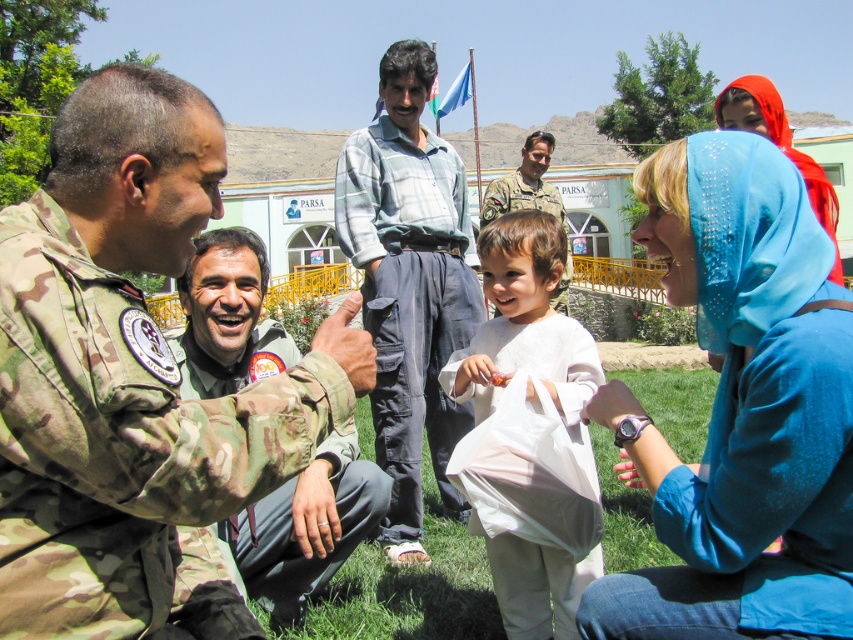
Question: Which object is positioned closest to the camo uniform at left?

Choices:
 (A) blue fabric headscarf at upper right
 (B) camo fabric uniform at center

Answer: (B)

Question: Is light blue plaid shirt at center to the left of camo fabric uniform at center from the viewer's perspective?

Choices:
 (A) yes
 (B) no

Answer: (B)

Question: Which object appears closest to the camera in this image?

Choices:
 (A) light blue plaid shirt at center
 (B) white cotton shirt at center
 (C) blue fabric headscarf at lower right

Answer: (C)

Question: Can you confirm if blue fabric headscarf at lower right is smaller than camo fabric uniform at center?

Choices:
 (A) no
 (B) yes

Answer: (A)

Question: Which point is farther from the camera taking this photo?

Choices:
 (A) (514, 189)
 (B) (219, 536)
 (C) (428, 164)
 (D) (503, 282)

Answer: (A)

Question: Does blue fabric headscarf at lower right appear over white cotton shirt at center?

Choices:
 (A) no
 (B) yes

Answer: (B)